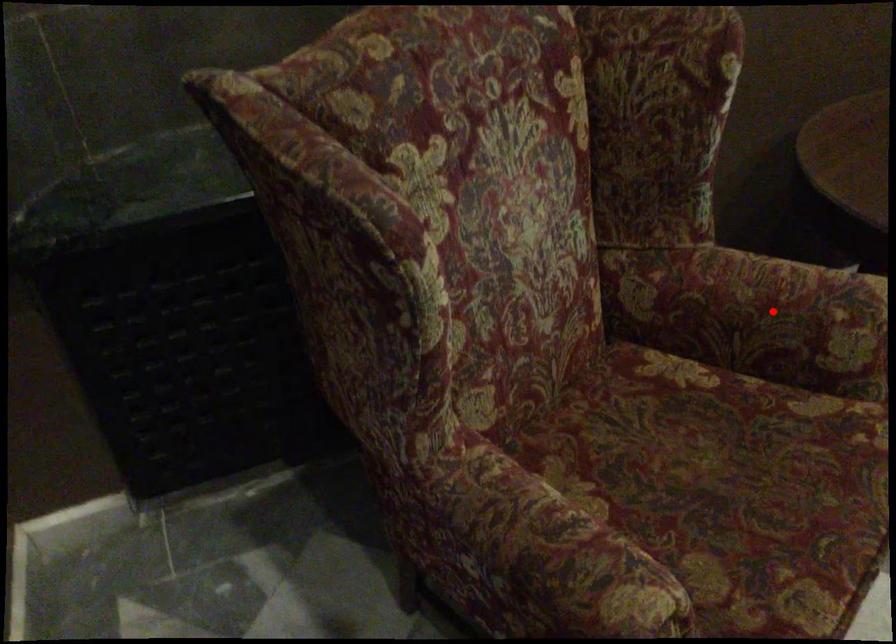
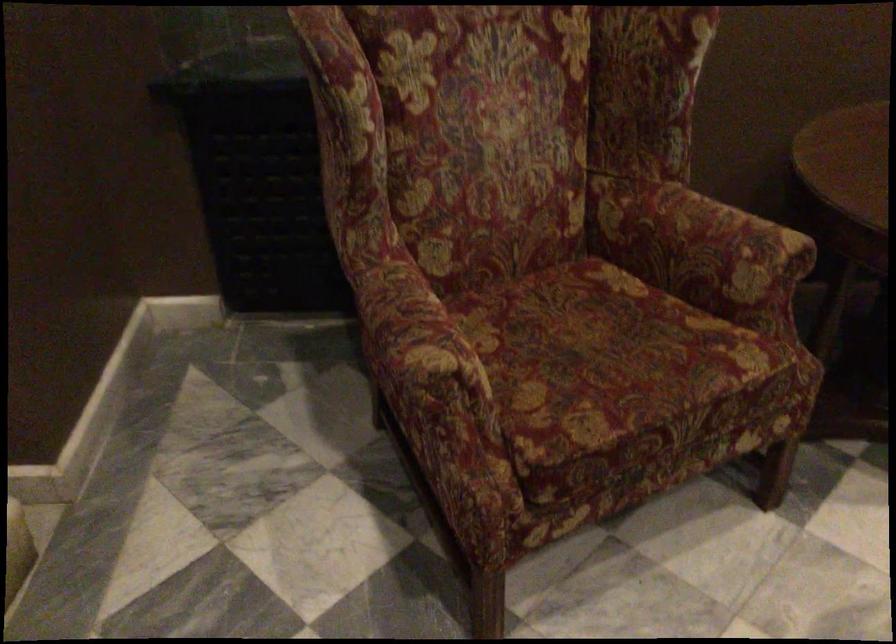
Question: I am providing you with two images of the same scene from different viewpoints. Image1 has a red point marked. In image2, the corresponding 3D location appears at what relative position? Reply with the corresponding letter.

Choices:
 (A) Closer
 (B) Farther

Answer: (B)